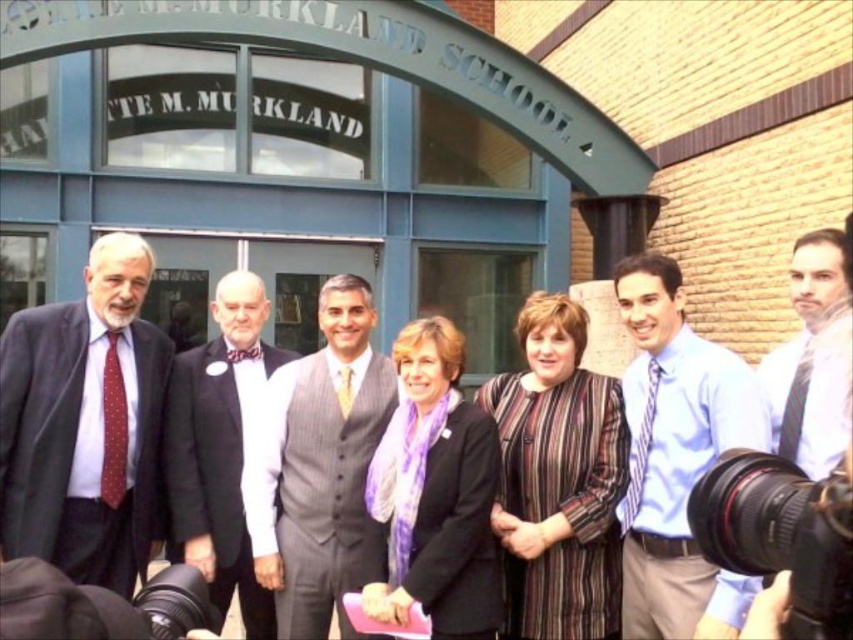
Find the location of a particular element. The image size is (853, 640). dark gray suit at left is located at coordinates (84, 422).

Is point (460, 584) closer to camera compared to point (234, 560)?

Yes, point (460, 584) is closer to viewer.

Between point (459, 616) and point (224, 333), which one is positioned in front?

Point (459, 616) is more forward.

Between point (451, 385) and point (218, 458), which one is positioned in front?

Positioned in front is point (451, 385).

Where is `purple silk scarf at center`? This screenshot has height=640, width=853. purple silk scarf at center is located at coordinates (434, 493).

Which is below, black satin bow tie at center or light brown textured tie at center?

black satin bow tie at center

Does black satin bow tie at center have a greater height compared to light brown textured tie at center?

Indeed, black satin bow tie at center has a greater height compared to light brown textured tie at center.

This screenshot has height=640, width=853. Identify the location of black satin bow tie at center. (218, 451).